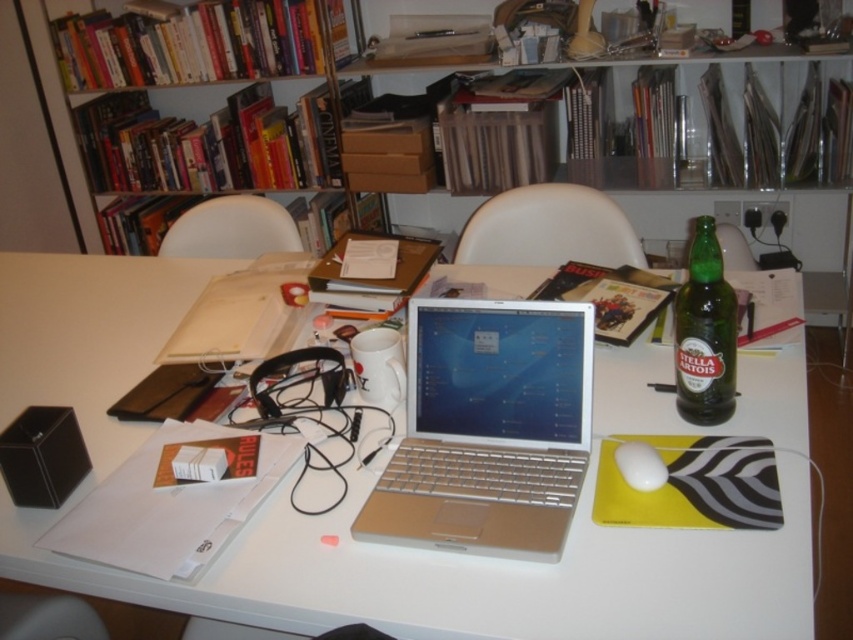
You are standing in front of the desk and want to place a 12 inch wide book on the white plastic table at center. Is there enough space for the book?

The white plastic table at center is 32.07 inches from camera, so the distance is sufficient to place a 12 inch wide book.

Consider the image. You are navigating a small drone through the cluttered desk area. There are two points marked as point 1 at coordinates point (634, 404) and point 2 at coordinates point (643, 444). Which point is closer to the edge of the desk?

Point 2 at coordinates point (643, 444) is closer to the edge of the desk because it is in front of point 1, which is further back from the edge.

From the picture: You are standing at the desk in the image and want to reach both points mentioned. Which point is closer to you, point (x=235, y=145) or point (x=619, y=448)?

Point (x=619, y=448) is closer to you because it is in front of point (x=235, y=145).